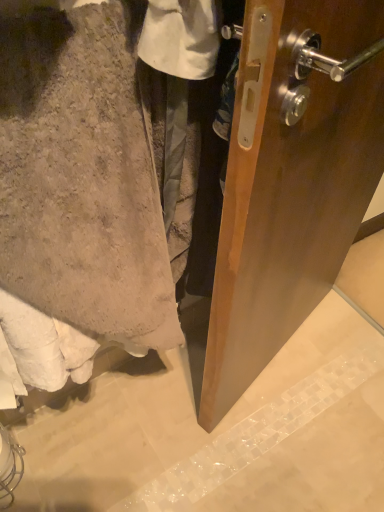
At what (x,y) coordinates should I click in order to perform the action: click on smooth concrete wall at lower left. Please return your answer as a coordinate pair (x, y). Image resolution: width=384 pixels, height=512 pixels. Looking at the image, I should click on (219, 432).

What do you see at coordinates (219, 432) in the screenshot? Image resolution: width=384 pixels, height=512 pixels. I see `smooth concrete wall at lower left` at bounding box center [219, 432].

What do you see at coordinates (82, 176) in the screenshot?
I see `beige fuzzy towel at lower left` at bounding box center [82, 176].

Locate an element on the screen. Image resolution: width=384 pixels, height=512 pixels. beige fuzzy towel at lower left is located at coordinates (82, 176).

This screenshot has width=384, height=512. I want to click on smooth concrete wall at lower left, so click(x=219, y=432).

Visually, is beige fuzzy towel at lower left positioned to the left or to the right of smooth concrete wall at lower left?

From the image, it's evident that beige fuzzy towel at lower left is to the left of smooth concrete wall at lower left.

Considering the relative positions of beige fuzzy towel at lower left and smooth concrete wall at lower left in the image provided, is beige fuzzy towel at lower left behind smooth concrete wall at lower left?

No, beige fuzzy towel at lower left is closer to the viewer.

Which point is more forward, (139,336) or (359,478)?

Positioned in front is point (139,336).

Looking at this image, from the image's perspective, is beige fuzzy towel at lower left over smooth concrete wall at lower left?

Yes, from the image's perspective, beige fuzzy towel at lower left is above smooth concrete wall at lower left.

From a real-world perspective, which is physically below, beige fuzzy towel at lower left or smooth concrete wall at lower left?

smooth concrete wall at lower left, from a real-world perspective.

Considering the sizes of beige fuzzy towel at lower left and smooth concrete wall at lower left in the image, is beige fuzzy towel at lower left wider or thinner than smooth concrete wall at lower left?

In the image, beige fuzzy towel at lower left appears to be more narrow than smooth concrete wall at lower left.

Based on the photo, who is taller, beige fuzzy towel at lower left or smooth concrete wall at lower left?

beige fuzzy towel at lower left.

Consider the image. Who is bigger, beige fuzzy towel at lower left or smooth concrete wall at lower left?

Bigger between the two is beige fuzzy towel at lower left.

Is beige fuzzy towel at lower left surrounding smooth concrete wall at lower left?

Definitely not — smooth concrete wall at lower left is not inside beige fuzzy towel at lower left.

Are beige fuzzy towel at lower left and smooth concrete wall at lower left making contact?

No, beige fuzzy towel at lower left is not touching smooth concrete wall at lower left.

Is beige fuzzy towel at lower left facing towards smooth concrete wall at lower left?

No, beige fuzzy towel at lower left is not facing towards smooth concrete wall at lower left.

How distant is beige fuzzy towel at lower left from smooth concrete wall at lower left?

25.68 inches.

This screenshot has width=384, height=512. What are the coordinates of `concrete that appears on the right of beige fuzzy towel at lower left` in the screenshot? It's located at (219, 432).

Considering the positions of objects smooth concrete wall at lower left and beige fuzzy towel at lower left in the image provided, who is more to the left, smooth concrete wall at lower left or beige fuzzy towel at lower left?

Positioned to the left is beige fuzzy towel at lower left.

Is the position of smooth concrete wall at lower left less distant than that of beige fuzzy towel at lower left?

No, it is not.

Which is in front, point (358, 341) or point (100, 8)?

The point (100, 8) is closer.

From the image's perspective, does smooth concrete wall at lower left appear lower than beige fuzzy towel at lower left?

Yes, from the image's perspective, smooth concrete wall at lower left is below beige fuzzy towel at lower left.

From a real-world perspective, between smooth concrete wall at lower left and beige fuzzy towel at lower left, who is vertically lower?

smooth concrete wall at lower left is physically lower.

Does smooth concrete wall at lower left have a lesser width compared to beige fuzzy towel at lower left?

In fact, smooth concrete wall at lower left might be wider than beige fuzzy towel at lower left.

Who is taller, smooth concrete wall at lower left or beige fuzzy towel at lower left?

Answer: beige fuzzy towel at lower left.

Based on their sizes in the image, would you say smooth concrete wall at lower left is bigger or smaller than beige fuzzy towel at lower left?

smooth concrete wall at lower left is smaller than beige fuzzy towel at lower left.

Is beige fuzzy towel at lower left located within smooth concrete wall at lower left?

No, beige fuzzy towel at lower left is not a part of smooth concrete wall at lower left.

Is smooth concrete wall at lower left far from beige fuzzy towel at lower left?

No, smooth concrete wall at lower left is not far from beige fuzzy towel at lower left.

Is smooth concrete wall at lower left oriented towards beige fuzzy towel at lower left?

No, smooth concrete wall at lower left is not aimed at beige fuzzy towel at lower left.

What's the angular difference between smooth concrete wall at lower left and beige fuzzy towel at lower left's facing directions?

smooth concrete wall at lower left and beige fuzzy towel at lower left are facing 90.7 degrees away from each other.

Where is `towel that is above the smooth concrete wall at lower left (from a real-world perspective)`? The height and width of the screenshot is (512, 384). towel that is above the smooth concrete wall at lower left (from a real-world perspective) is located at coordinates (x=82, y=176).

This screenshot has width=384, height=512. What are the coordinates of `towel that appears above the smooth concrete wall at lower left (from a real-world perspective)` in the screenshot? It's located at (82, 176).

At what (x,y) coordinates should I click in order to perform the action: click on concrete beneath the beige fuzzy towel at lower left (from a real-world perspective). Please return your answer as a coordinate pair (x, y). The width and height of the screenshot is (384, 512). Looking at the image, I should click on (219, 432).